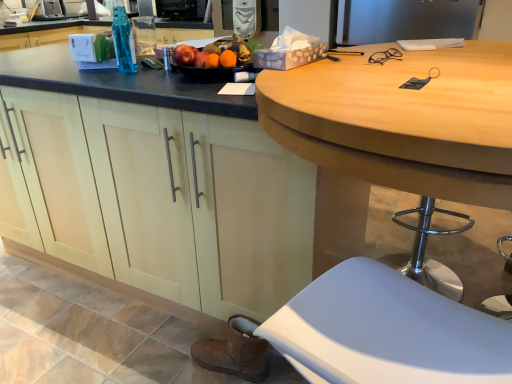
The width and height of the screenshot is (512, 384). In order to click on vacant area that is in front of clear plastic glasses at upper right in this screenshot , I will do `click(404, 74)`.